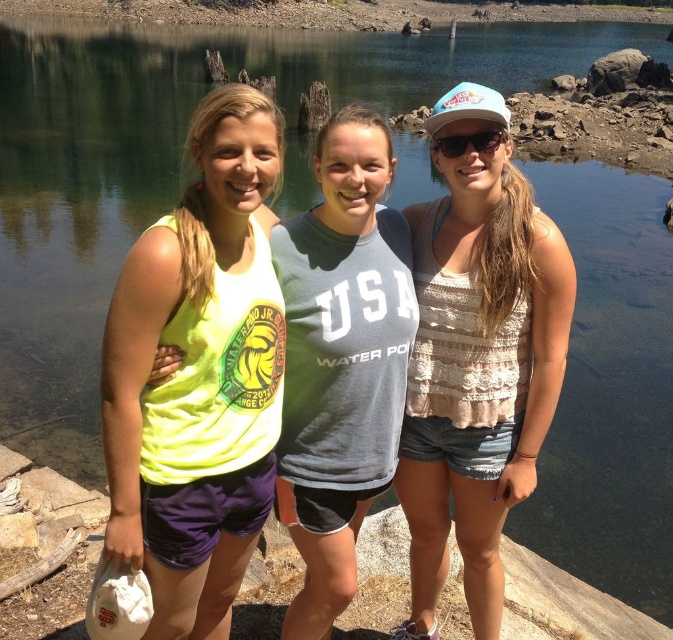
Question: Does neon yellow tank top at center lie in front of white textured tank top at center?

Choices:
 (A) yes
 (B) no

Answer: (A)

Question: Can you confirm if neon yellow tank top at center is bigger than white textured tank top at center?

Choices:
 (A) yes
 (B) no

Answer: (B)

Question: Where is neon yellow tank top at center located in relation to white textured tank top at center in the image?

Choices:
 (A) right
 (B) left

Answer: (B)